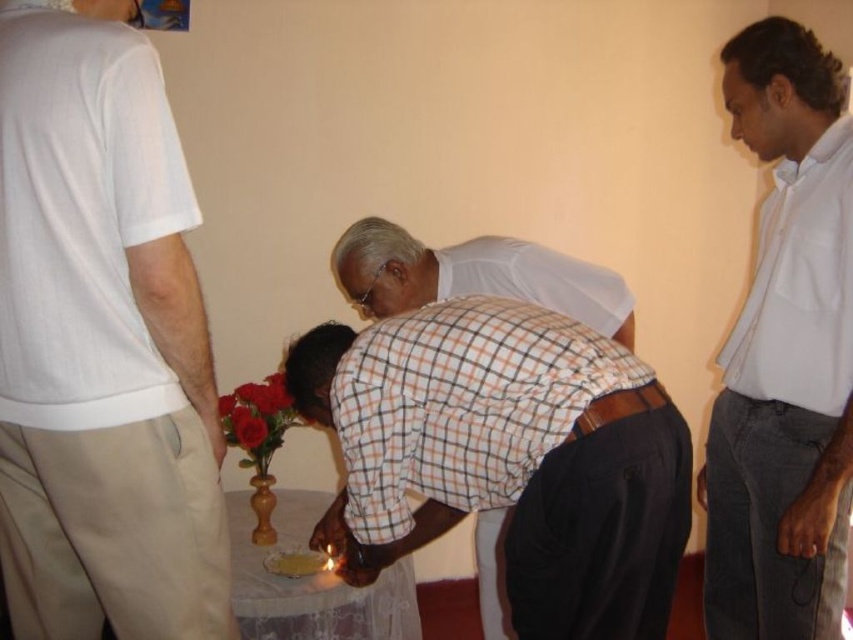
Question: Which object is closer to the camera taking this photo?

Choices:
 (A) smooth red roses at center
 (B) checkered fabric shirt at center

Answer: (B)

Question: Does white cotton shirt at upper right have a smaller size compared to smooth red roses at center?

Choices:
 (A) no
 (B) yes

Answer: (A)

Question: Which of the following is the closest to the observer?

Choices:
 (A) white cotton shirt at upper left
 (B) smooth white table at center
 (C) checkered fabric shirt at center

Answer: (A)

Question: Does white cotton shirt at upper left lie behind checkered fabric shirt at center?

Choices:
 (A) no
 (B) yes

Answer: (A)

Question: Does white cotton shirt at upper left appear over checkered fabric shirt at center?

Choices:
 (A) no
 (B) yes

Answer: (A)

Question: Which is farther from the smooth white table at center?

Choices:
 (A) white cotton shirt at upper right
 (B) white cotton shirt at upper left
 (C) smooth red roses at center
 (D) checkered fabric shirt at center

Answer: (A)